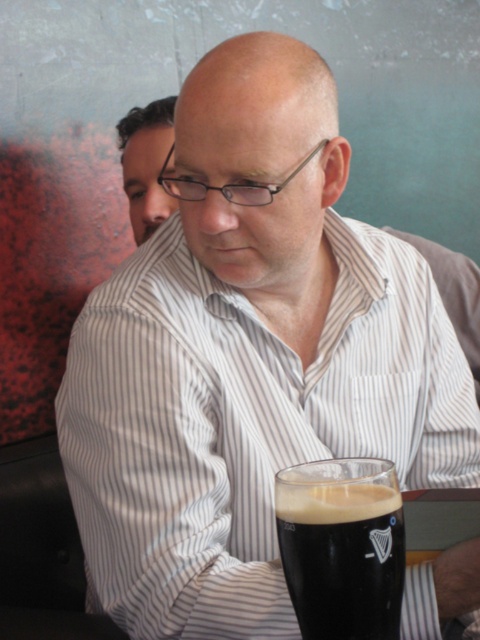
Is dark brown glass at lower center below matte black hair at upper left?

Yes, dark brown glass at lower center is below matte black hair at upper left.

The height and width of the screenshot is (640, 480). Describe the element at coordinates (342, 547) in the screenshot. I see `dark brown glass at lower center` at that location.

Locate an element on the screen. dark brown glass at lower center is located at coordinates (342, 547).